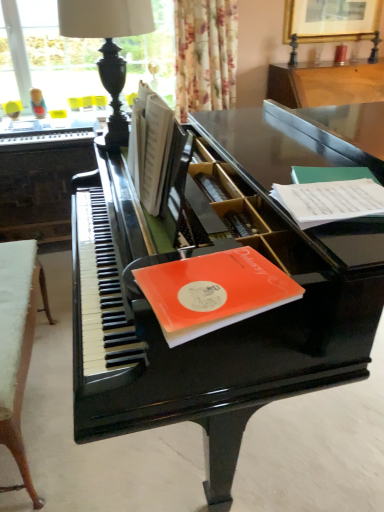
Question: From the image's perspective, would you say orange matte paper at piano top, which is the first paperback book from left to right, is shown under black polished wood table lamp at upper left?

Choices:
 (A) yes
 (B) no

Answer: (A)

Question: From a real-world perspective, is orange matte paper at piano top, placed as the 2th paperback book when sorted from right to left, under black polished wood table lamp at upper left?

Choices:
 (A) no
 (B) yes

Answer: (B)

Question: Is orange matte paper at piano top, which is the first paperback book from left to right, to the right of black polished wood table lamp at upper left from the viewer's perspective?

Choices:
 (A) no
 (B) yes

Answer: (B)

Question: Is orange matte paper at piano top, placed as the 2th paperback book when sorted from right to left, aimed at black polished wood table lamp at upper left?

Choices:
 (A) no
 (B) yes

Answer: (A)

Question: Can black polished wood table lamp at upper left be found inside orange matte paper at piano top, which is the first paperback book from left to right?

Choices:
 (A) no
 (B) yes

Answer: (A)

Question: Is orange matte paper at piano top, positioned as the 2th paperback book in top-to-bottom order, facing away from black polished wood table lamp at upper left?

Choices:
 (A) yes
 (B) no

Answer: (B)

Question: From the image's perspective, is white paper at right, the second paperback book positioned from the left, on top of glossy black piano at center?

Choices:
 (A) yes
 (B) no

Answer: (A)

Question: Is white paper at right, the first paperback book from the right, next to glossy black piano at center and touching it?

Choices:
 (A) yes
 (B) no

Answer: (B)

Question: Is white paper at right, arranged as the first paperback book when viewed from the back, aimed at glossy black piano at center?

Choices:
 (A) yes
 (B) no

Answer: (A)

Question: From the image's perspective, is white paper at right, marked as the second paperback book in a front-to-back arrangement, below glossy black piano at center?

Choices:
 (A) no
 (B) yes

Answer: (A)

Question: From a real-world perspective, is white paper at right, acting as the 1th paperback book starting from the top, positioned over glossy black piano at center based on gravity?

Choices:
 (A) no
 (B) yes

Answer: (B)

Question: From a real-world perspective, does white paper at right, marked as the second paperback book in a front-to-back arrangement, sit lower than glossy black piano at center?

Choices:
 (A) yes
 (B) no

Answer: (B)

Question: Would you say white paper book at center is part of white paper at right, acting as the 1th paperback book starting from the top,'s contents?

Choices:
 (A) no
 (B) yes

Answer: (A)